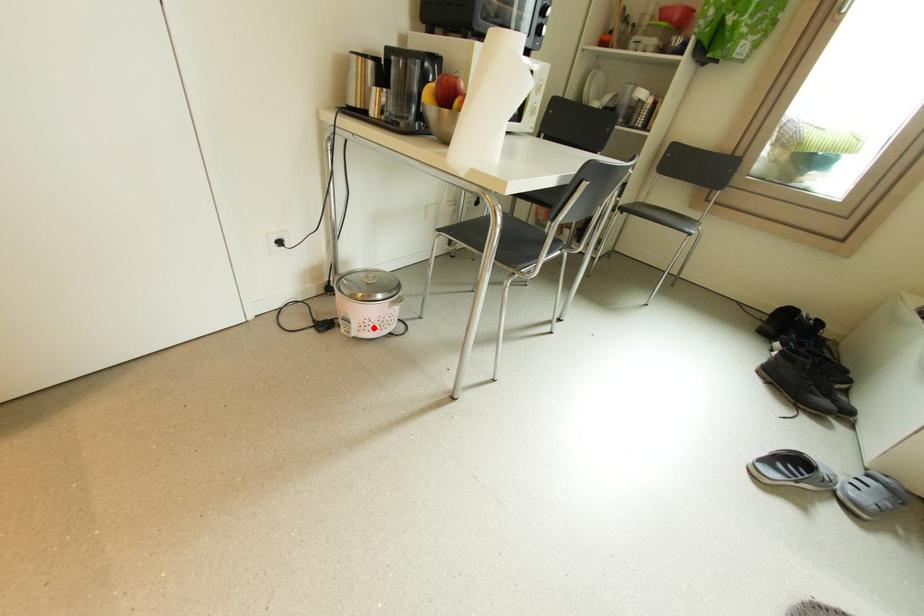
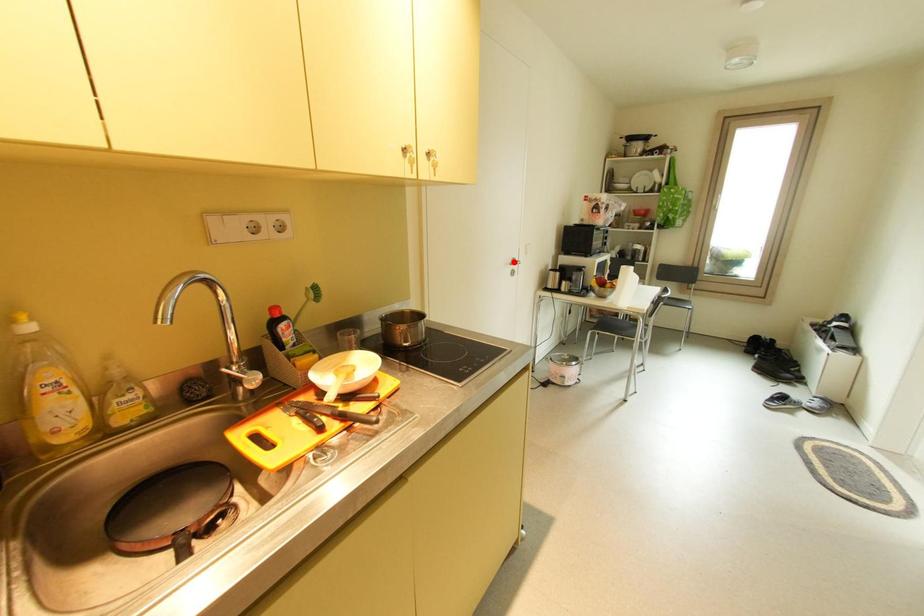
I am providing you with two images of the same scene from different viewpoints. A red point is marked on the first image and another point is marked on the second image. Do the highlighted points in image1 and image2 indicate the same real-world spot?

No